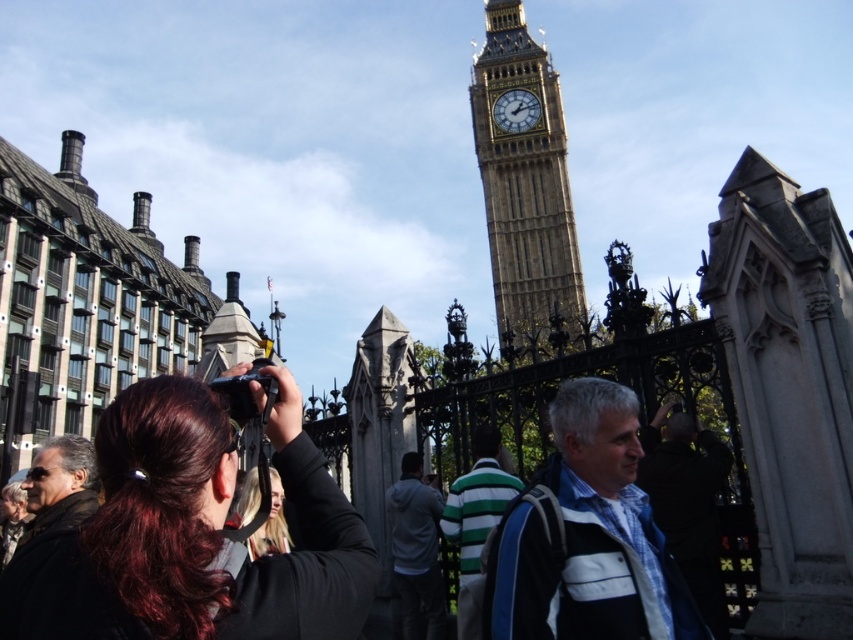
Does stone clock tower at center have a greater height compared to blue striped shirt at center?

Correct, stone clock tower at center is much taller as blue striped shirt at center.

Who is shorter, stone clock tower at center or blue striped shirt at center?

blue striped shirt at center

Who is more forward, (503, 54) or (682, 484)?

Point (682, 484) is more forward.

This screenshot has width=853, height=640. Identify the location of stone clock tower at center. (524, 182).

Is blue striped shirt at center to the left of gray hoodie at center from the viewer's perspective?

In fact, blue striped shirt at center is to the right of gray hoodie at center.

Which is above, blue striped shirt at center or gray hoodie at center?

blue striped shirt at center is above.

Does point (680, 428) lie behind point (402, 637)?

No, (680, 428) is in front of (402, 637).

Find the location of a particular element. blue striped shirt at center is located at coordinates (688, 502).

Is gray hoodie at center thinner than gold textured clock at center?

Yes.

Looking at this image, which of these two, gray hoodie at center or gold textured clock at center, stands shorter?

With less height is gold textured clock at center.

Which is behind, point (428, 536) or point (503, 128)?

Point (503, 128)

Where is `gray hoodie at center`? gray hoodie at center is located at coordinates (415, 552).